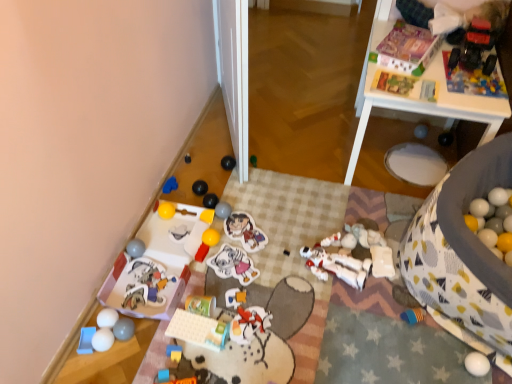
The width and height of the screenshot is (512, 384). Find the location of `vacant area that lies between yellow matte ball at center, arranged as the 14th toy when viewed from the right, and white matte sticker at center, the 8th toy from the right`. vacant area that lies between yellow matte ball at center, arranged as the 14th toy when viewed from the right, and white matte sticker at center, the 8th toy from the right is located at coordinates (219, 241).